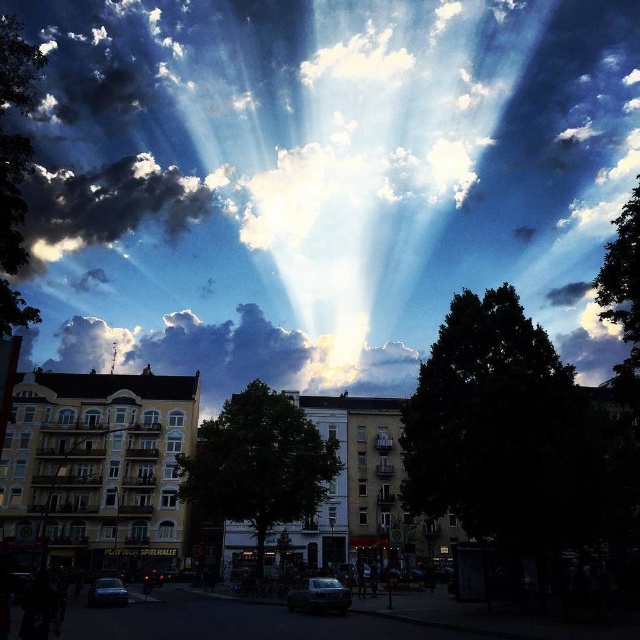
Question: Which object is the closest to the dark green leafy tree at center?

Choices:
 (A) green leafy tree at center
 (B) white fluffy cloud at upper center
 (C) dark green leafy tree at upper right

Answer: (A)

Question: Does dark green leafy tree at center have a smaller size compared to green leafy tree at center?

Choices:
 (A) no
 (B) yes

Answer: (A)

Question: Among these points, which one is farthest from the camera?

Choices:
 (A) (260, 451)
 (B) (621, 212)

Answer: (B)

Question: Can you confirm if green leafy tree at center is positioned above green leafy tree at left?

Choices:
 (A) yes
 (B) no

Answer: (B)

Question: Is the position of dark green leafy tree at center more distant than that of green leafy tree at center?

Choices:
 (A) yes
 (B) no

Answer: (B)

Question: Based on their relative distances, which object is nearer to the white fluffy cloud at upper center?

Choices:
 (A) dark fluffy cloud at upper left
 (B) dark green leafy tree at center
 (C) cloudy sky at center

Answer: (A)